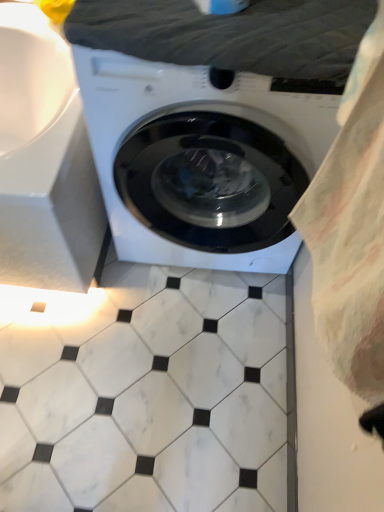
What is the approximate width of white glossy washing machine at center?

The width of white glossy washing machine at center is 20.66 inches.

Identify the location of white glossy washing machine at center. (201, 160).

Describe the element at coordinates (201, 160) in the screenshot. I see `white glossy washing machine at center` at that location.

Describe the element at coordinates (232, 36) in the screenshot. I see `dark gray fabric at upper center` at that location.

Find the location of a particular element. The image size is (384, 512). dark gray fabric at upper center is located at coordinates (232, 36).

In order to face dark gray fabric at upper center, should I rotate leftwards or rightwards?

You should rotate right by 4.264 degrees.

The height and width of the screenshot is (512, 384). Find the location of `white glossy washing machine at center`. white glossy washing machine at center is located at coordinates (201, 160).

Considering the relative positions of dark gray fabric at upper center and white glossy washing machine at center in the image provided, is dark gray fabric at upper center to the left of white glossy washing machine at center from the viewer's perspective?

Incorrect, dark gray fabric at upper center is not on the left side of white glossy washing machine at center.

In the scene shown: Is dark gray fabric at upper center closer to the viewer compared to white glossy washing machine at center?

No, the depth of dark gray fabric at upper center is greater than that of white glossy washing machine at center.

Is point (293, 68) behind point (268, 109)?

No, it is in front of (268, 109).

From the image's perspective, is dark gray fabric at upper center above white glossy washing machine at center?

Yes, from the image's perspective, dark gray fabric at upper center is on top of white glossy washing machine at center.

From a real-world perspective, between dark gray fabric at upper center and white glossy washing machine at center, who is vertically higher?

From a 3D spatial view, dark gray fabric at upper center is above.

Between dark gray fabric at upper center and white glossy washing machine at center, which one has larger width?

Wider between the two is white glossy washing machine at center.

Considering the sizes of objects dark gray fabric at upper center and white glossy washing machine at center in the image provided, who is taller, dark gray fabric at upper center or white glossy washing machine at center?

Standing taller between the two is white glossy washing machine at center.

Considering the sizes of objects dark gray fabric at upper center and white glossy washing machine at center in the image provided, who is smaller, dark gray fabric at upper center or white glossy washing machine at center?

dark gray fabric at upper center is smaller.

Can we say dark gray fabric at upper center lies outside white glossy washing machine at center?

That's incorrect, dark gray fabric at upper center is not completely outside white glossy washing machine at center.

Would you consider dark gray fabric at upper center to be distant from white glossy washing machine at center?

No.

Is dark gray fabric at upper center aimed at white glossy washing machine at center?

Yes, dark gray fabric at upper center is turned towards white glossy washing machine at center.

How many degrees apart are the facing directions of dark gray fabric at upper center and white glossy washing machine at center?

The facing directions of dark gray fabric at upper center and white glossy washing machine at center are 8.1e-06 degrees apart.

In order to click on washing machine below the dark gray fabric at upper center (from the image's perspective) in this screenshot , I will do `click(201, 160)`.

Considering the relative positions of white glossy washing machine at center and dark gray fabric at upper center in the image provided, is white glossy washing machine at center to the left of dark gray fabric at upper center from the viewer's perspective?

Indeed, white glossy washing machine at center is positioned on the left side of dark gray fabric at upper center.

Is the depth of white glossy washing machine at center greater than that of dark gray fabric at upper center?

No, it is in front of dark gray fabric at upper center.

Which is behind, point (116, 188) or point (289, 71)?

The point (116, 188) is more distant.

From the image's perspective, relative to dark gray fabric at upper center, is white glossy washing machine at center above or below?

Clearly, from the image's perspective, white glossy washing machine at center is below dark gray fabric at upper center.

From a real-world perspective, is white glossy washing machine at center positioned over dark gray fabric at upper center based on gravity?

Actually, white glossy washing machine at center is physically below dark gray fabric at upper center in the real world.

Is white glossy washing machine at center wider than dark gray fabric at upper center?

Yes.

Looking at this image, considering the relative sizes of white glossy washing machine at center and dark gray fabric at upper center in the image provided, is white glossy washing machine at center taller than dark gray fabric at upper center?

Yes, white glossy washing machine at center is taller than dark gray fabric at upper center.

Consider the image. In terms of size, does white glossy washing machine at center appear bigger or smaller than dark gray fabric at upper center?

Considering their sizes, white glossy washing machine at center takes up more space than dark gray fabric at upper center.

Would you say white glossy washing machine at center is inside or outside dark gray fabric at upper center?

white glossy washing machine at center lies outside dark gray fabric at upper center.

Is white glossy washing machine at center with dark gray fabric at upper center?

No, white glossy washing machine at center is not touching dark gray fabric at upper center.

Looking at this image, is dark gray fabric at upper center at the back of white glossy washing machine at center?

No.

How different are the orientations of white glossy washing machine at center and dark gray fabric at upper center in degrees?

They differ by 8.1e-06 degrees in their facing directions.

This screenshot has height=512, width=384. What are the coordinates of `sheet behind the white glossy washing machine at center` in the screenshot? It's located at (232, 36).

At what (x,y) coordinates should I click in order to perform the action: click on sheet that is above the white glossy washing machine at center (from the image's perspective). Please return your answer as a coordinate pair (x, y). The height and width of the screenshot is (512, 384). Looking at the image, I should click on (232, 36).

This screenshot has height=512, width=384. I want to click on washing machine on the left of dark gray fabric at upper center, so (x=201, y=160).